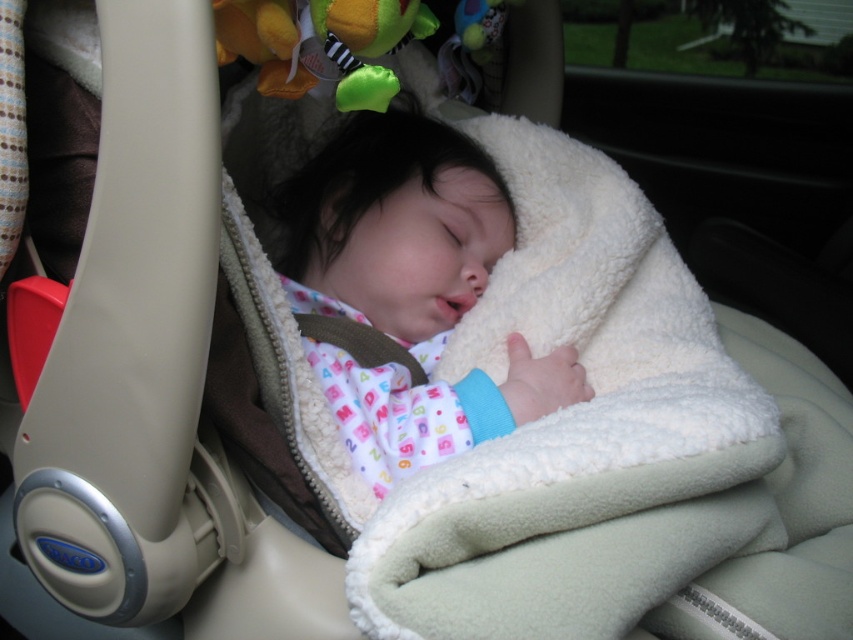
Is white fleece baby at center bigger than soft plush frog at upper center?

Indeed, white fleece baby at center has a larger size compared to soft plush frog at upper center.

Who is shorter, white fleece baby at center or soft plush frog at upper center?

soft plush frog at upper center is shorter.

Describe the element at coordinates (395, 227) in the screenshot. I see `white fleece baby at center` at that location.

Where is `white fleece baby at center`? The image size is (853, 640). white fleece baby at center is located at coordinates (395, 227).

Is white fleece blanket at center positioned before soft plush frog at upper center?

Yes, it is.

Where is `white fleece blanket at center`? white fleece blanket at center is located at coordinates (567, 420).

Consider the image. Can you confirm if white fleece blanket at center is taller than white fleece baby at center?

Correct, white fleece blanket at center is much taller as white fleece baby at center.

Does point (625, 186) come closer to viewer compared to point (428, 221)?

No, (625, 186) is further to viewer.

Who is more forward, (618, 474) or (503, 381)?

Point (618, 474) is in front.

Identify the location of white fleece blanket at center. The height and width of the screenshot is (640, 853). (567, 420).